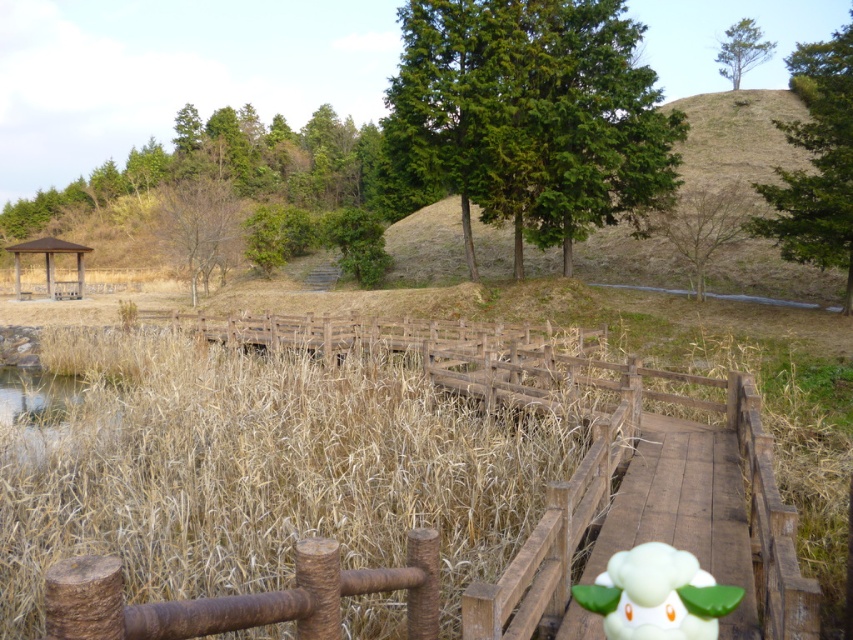
You are standing on the wooden bridge and want to walk towards the pavilion. There are two points marked on the bridge. Which point, point (650, 552) or point (77, 275), is closer to you as you start walking towards the pavilion?

Point (650, 552) is closer to the viewer than point (77, 275), so it is closer to you as you start walking towards the pavilion.

You are a gardener who needs to place a new decorative statue that is 2 meters wide between the dry grass at center and the white matte plush toy at center. Based on the scene, will there be enough space between them to fit the statue?

The distance between the dry grass at center and the white matte plush toy at center is 6.46 meters. Since the statue is 2 meters wide, there is sufficient space to place it between them.

You are standing on the wooden bridge and want to place a small flag on the closest object to you between the dry grass at center and the brown wooden gazebo at left. Which object should you choose?

You should place the flag on the dry grass at center because it is closer to you than the brown wooden gazebo at left.